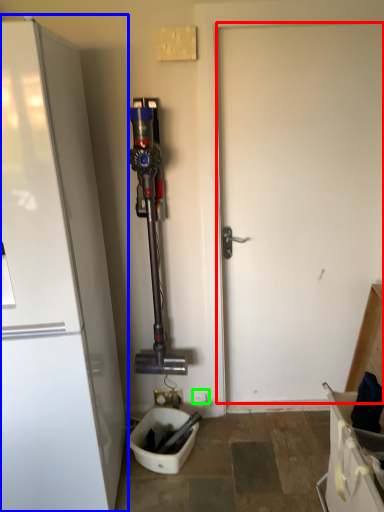
Question: Based on their relative distances, which object is farther from door (highlighted by a red box)? Choose from refrigerator (highlighted by a blue box) and electric outlet (highlighted by a green box).

Choices:
 (A) refrigerator
 (B) electric outlet

Answer: (B)